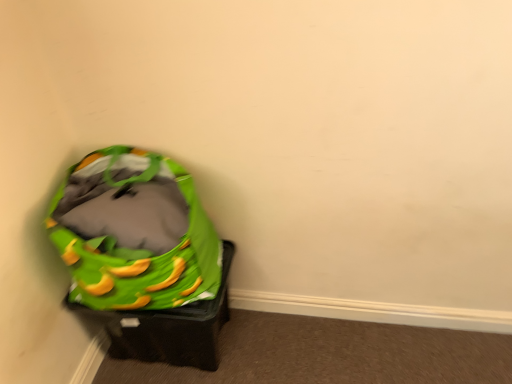
What do you see at coordinates (169, 328) in the screenshot? This screenshot has width=512, height=384. I see `green fabric bag at lower left` at bounding box center [169, 328].

The height and width of the screenshot is (384, 512). Identify the location of green fabric bag at lower left. (169, 328).

Measure the distance between point (x=125, y=326) and camera.

The depth of point (x=125, y=326) is 4.34 feet.

Describe the element at coordinates (134, 233) in the screenshot. The height and width of the screenshot is (384, 512). I see `green fabric bean bag chair at left` at that location.

Locate an element on the screen. The width and height of the screenshot is (512, 384). green fabric bean bag chair at left is located at coordinates (134, 233).

Measure the distance between point (x=121, y=273) and camera.

Point (x=121, y=273) is 39.29 inches away from camera.

Where is `green fabric bag at lower left`? green fabric bag at lower left is located at coordinates (169, 328).

Looking at this image, is green fabric bag at lower left to the left or to the right of green fabric bean bag chair at left in the image?

In the image, green fabric bag at lower left appears on the right side of green fabric bean bag chair at left.

Which object is further away from the camera taking this photo, green fabric bag at lower left or green fabric bean bag chair at left?

green fabric bag at lower left is more distant.

Which is behind, point (116, 350) or point (82, 242)?

The point (116, 350) is more distant.

From the image's perspective, which one is positioned lower, green fabric bag at lower left or green fabric bean bag chair at left?

green fabric bag at lower left, from the image's perspective.

From a real-world perspective, between green fabric bag at lower left and green fabric bean bag chair at left, who is vertically higher?

green fabric bean bag chair at left, from a real-world perspective.

Considering the relative sizes of green fabric bag at lower left and green fabric bean bag chair at left in the image provided, is green fabric bag at lower left wider than green fabric bean bag chair at left?

In fact, green fabric bag at lower left might be narrower than green fabric bean bag chair at left.

Does green fabric bag at lower left have a lesser height compared to green fabric bean bag chair at left?

Yes, green fabric bag at lower left is shorter than green fabric bean bag chair at left.

In the scene shown: Considering the sizes of objects green fabric bag at lower left and green fabric bean bag chair at left in the image provided, who is bigger, green fabric bag at lower left or green fabric bean bag chair at left?

green fabric bean bag chair at left.

Is green fabric bag at lower left inside the boundaries of green fabric bean bag chair at left, or outside?

green fabric bag at lower left cannot be found inside green fabric bean bag chair at left.

Is green fabric bag at lower left far away from green fabric bean bag chair at left?

No, green fabric bag at lower left is not far away from green fabric bean bag chair at left.

Does green fabric bag at lower left turn towards green fabric bean bag chair at left?

No, green fabric bag at lower left is not oriented towards green fabric bean bag chair at left.

How far apart are green fabric bag at lower left and green fabric bean bag chair at left?

green fabric bag at lower left and green fabric bean bag chair at left are 8.93 inches apart.

Locate an element on the screen. bean bag chair positioned vertically above the green fabric bag at lower left (from a real-world perspective) is located at coordinates (134, 233).

Between green fabric bean bag chair at left and green fabric bag at lower left, which one appears on the left side from the viewer's perspective?

From the viewer's perspective, green fabric bean bag chair at left appears more on the left side.

In the image, is green fabric bean bag chair at left positioned in front of or behind green fabric bag at lower left?

green fabric bean bag chair at left is positioned closer to the viewer than green fabric bag at lower left.

Which point is more forward, (101,223) or (165,326)?

The point (101,223) is closer.

From the image's perspective, is green fabric bean bag chair at left located above green fabric bag at lower left?

Yes.

From a real-world perspective, is green fabric bean bag chair at left over green fabric bag at lower left?

Yes, from a real-world perspective, green fabric bean bag chair at left is above green fabric bag at lower left.

In terms of width, does green fabric bean bag chair at left look wider or thinner when compared to green fabric bag at lower left?

Considering their sizes, green fabric bean bag chair at left looks broader than green fabric bag at lower left.

Is green fabric bean bag chair at left taller or shorter than green fabric bag at lower left?

green fabric bean bag chair at left is taller than green fabric bag at lower left.

Can you confirm if green fabric bean bag chair at left is smaller than green fabric bag at lower left?

Incorrect, green fabric bean bag chair at left is not smaller in size than green fabric bag at lower left.

Is green fabric bean bag chair at left outside of green fabric bag at lower left?

Yes, green fabric bean bag chair at left is outside of green fabric bag at lower left.

Is green fabric bean bag chair at left not near green fabric bag at lower left?

Actually, green fabric bean bag chair at left and green fabric bag at lower left are a little close together.

Could you tell me if green fabric bean bag chair at left is facing green fabric bag at lower left?

No, green fabric bean bag chair at left is not aimed at green fabric bag at lower left.

Can you tell me how much green fabric bean bag chair at left and green fabric bag at lower left differ in facing direction?

There is a 0.99-degree angle between the facing directions of green fabric bean bag chair at left and green fabric bag at lower left.

Where is `bean bag chair located above the green fabric bag at lower left (from a real-world perspective)`? bean bag chair located above the green fabric bag at lower left (from a real-world perspective) is located at coordinates (134, 233).

Find the location of a particular element. bean bag chair lying above the green fabric bag at lower left (from the image's perspective) is located at coordinates (134, 233).

The height and width of the screenshot is (384, 512). Find the location of `bean bag chair that appears on the left of green fabric bag at lower left`. bean bag chair that appears on the left of green fabric bag at lower left is located at coordinates (134, 233).